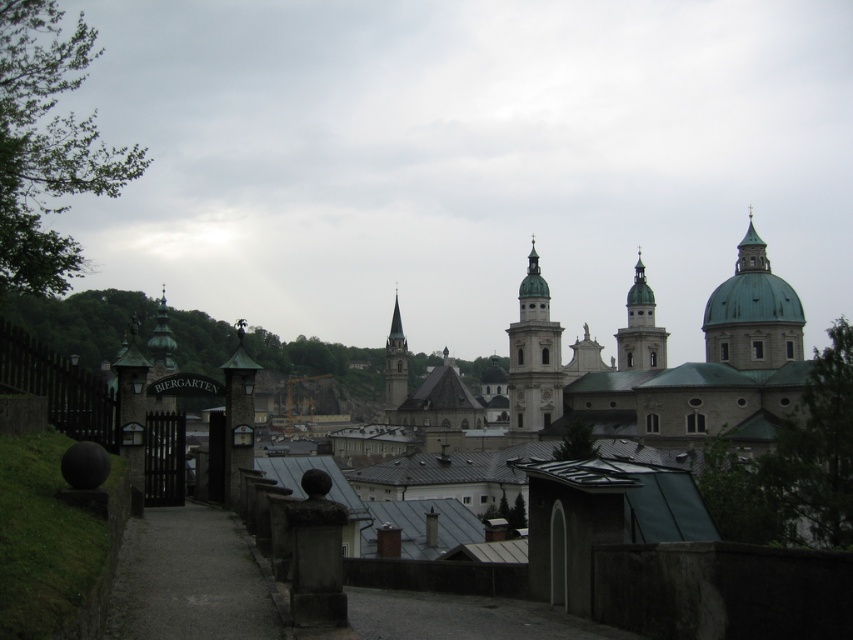
Question: Which of the following is the farthest from the observer?

Choices:
 (A) smooth gray stone tower at center
 (B) smooth white tower at center
 (C) matte stone town at center

Answer: (A)

Question: Where is gray gravel path at lower left located in relation to smooth white tower at center in the image?

Choices:
 (A) above
 (B) below

Answer: (B)

Question: Which point is closer to the camera taking this photo?

Choices:
 (A) pos(625,339)
 (B) pos(201,604)

Answer: (B)

Question: Observing the image, what is the correct spatial positioning of smooth stone tower at center in reference to smooth gray stone tower at center?

Choices:
 (A) right
 (B) left

Answer: (A)

Question: Where is smooth gray dome at upper right located in relation to smooth white tower at center in the image?

Choices:
 (A) below
 (B) above

Answer: (B)

Question: Estimate the real-world distances between objects in this image. Which object is farther from the smooth white tower at center?

Choices:
 (A) smooth gray stone tower at center
 (B) gray gravel path at lower left
 (C) smooth gray dome at upper right

Answer: (B)